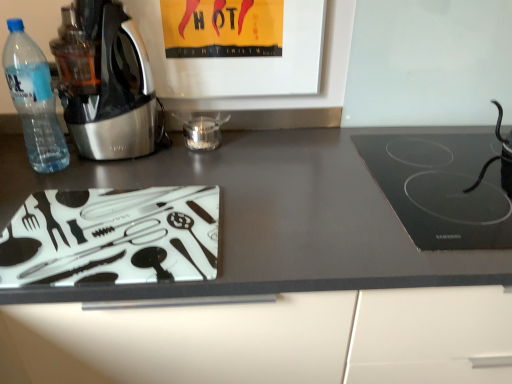
Question: Is metallic stainless steel kettle at left wider than transparent plastic bottle at left?

Choices:
 (A) no
 (B) yes

Answer: (B)

Question: Does metallic stainless steel kettle at left have a greater height compared to transparent plastic bottle at left?

Choices:
 (A) yes
 (B) no

Answer: (A)

Question: From a real-world perspective, is metallic stainless steel kettle at left located beneath transparent plastic bottle at left?

Choices:
 (A) no
 (B) yes

Answer: (A)

Question: From a real-world perspective, is metallic stainless steel kettle at left located higher than transparent plastic bottle at left?

Choices:
 (A) no
 (B) yes

Answer: (B)

Question: Is metallic stainless steel kettle at left outside transparent plastic bottle at left?

Choices:
 (A) yes
 (B) no

Answer: (A)

Question: Relative to matte glass cutting board at lower left, is transparent glass jar at center, which is the 2th appliance in right-to-left order, in front or behind?

Choices:
 (A) behind
 (B) front

Answer: (A)

Question: Is transparent glass jar at center, which is the 2th appliance in right-to-left order, inside the boundaries of matte glass cutting board at lower left, or outside?

Choices:
 (A) inside
 (B) outside

Answer: (B)

Question: From the image's perspective, is transparent glass jar at center, arranged as the first appliance when viewed from the left, positioned above or below matte glass cutting board at lower left?

Choices:
 (A) above
 (B) below

Answer: (A)

Question: Is point (210, 144) closer or farther from the camera than point (414, 294)?

Choices:
 (A) farther
 (B) closer

Answer: (A)

Question: Is point (202, 147) positioned closer to the camera than point (39, 59)?

Choices:
 (A) farther
 (B) closer

Answer: (A)

Question: Is transparent glass jar at center, which is the 2th appliance in right-to-left order, bigger or smaller than transparent plastic bottle at left?

Choices:
 (A) small
 (B) big

Answer: (A)

Question: Considering the relative positions of transparent glass jar at center, which is the 2th appliance in right-to-left order, and transparent plastic bottle at left in the image provided, is transparent glass jar at center, which is the 2th appliance in right-to-left order, to the left or to the right of transparent plastic bottle at left?

Choices:
 (A) left
 (B) right

Answer: (B)

Question: Considering the positions of transparent glass jar at center, arranged as the first appliance when viewed from the left, and transparent plastic bottle at left in the image, is transparent glass jar at center, arranged as the first appliance when viewed from the left, wider or thinner than transparent plastic bottle at left?

Choices:
 (A) thin
 (B) wide

Answer: (A)

Question: Considering the positions of black rubber cable at right, which is counted as the 2th appliance, starting from the left, and matte glass cutting board at lower left in the image, is black rubber cable at right, which is counted as the 2th appliance, starting from the left, taller or shorter than matte glass cutting board at lower left?

Choices:
 (A) tall
 (B) short

Answer: (B)

Question: Is point (499, 112) positioned closer to the camera than point (145, 334)?

Choices:
 (A) closer
 (B) farther

Answer: (B)